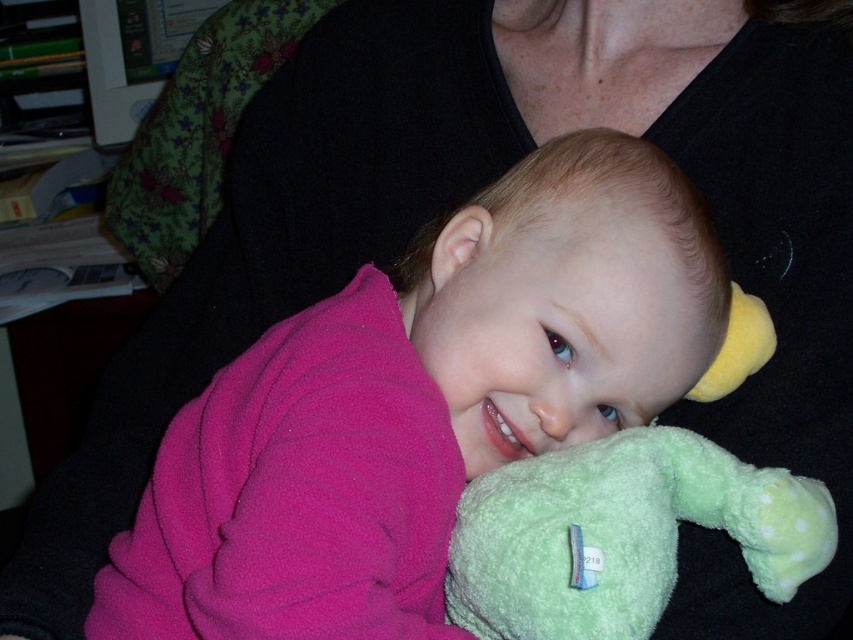
You are a photographer trying to capture the baby in the image. The camera is positioned at a certain distance from the point where the baby is facing. If the baby is facing the point at coordinates point [178,456], and the camera is 21.31 inches away from that point, can you estimate whether the baby is within the typical portrait photography distance range of 20 to 30 inches?

The point at coordinates point [178,456] is 21.31 inches away from the camera. Since this distance falls within the typical portrait photography range of 20 to 30 inches, the baby is within the recommended distance for a portrait.

You are a photographer trying to capture a clear shot of the pink fleece baby at center and the green plush toy at lower right. Since you want both subjects in focus, which one should you adjust your camera focus on first to ensure the closest object is sharp?

The pink fleece baby at center is closer to the viewer than the green plush toy at lower right, so you should focus on the pink fleece baby at center first to ensure it is sharp before adjusting for the other subject.

You are a photographer trying to capture a closeup of the baby in the image. The pink fleece baby at center and the green plush toy at lower right are both in the frame. If you want to ensure the baby takes up more space in the photo than the toy, which object should you focus on zooming in on?

The pink fleece baby at center is larger in width than the green plush toy at lower right, so focusing on zooming in on the pink fleece baby at center will ensure it takes up more space in the photo.